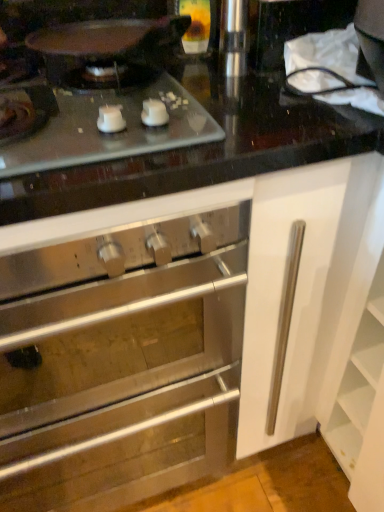
Question: From the image's perspective, does stainless steel oven at center appear higher than matte glass cooktop at upper left?

Choices:
 (A) yes
 (B) no

Answer: (B)

Question: Is stainless steel oven at center thinner than matte glass cooktop at upper left?

Choices:
 (A) no
 (B) yes

Answer: (A)

Question: Are stainless steel oven at center and matte glass cooktop at upper left making contact?

Choices:
 (A) yes
 (B) no

Answer: (B)

Question: Considering the relative sizes of stainless steel oven at center and matte glass cooktop at upper left in the image provided, is stainless steel oven at center bigger than matte glass cooktop at upper left?

Choices:
 (A) yes
 (B) no

Answer: (A)

Question: Could you tell me if stainless steel oven at center is facing matte glass cooktop at upper left?

Choices:
 (A) yes
 (B) no

Answer: (B)

Question: Considering the relative positions of stainless steel oven at center and matte glass cooktop at upper left in the image provided, is stainless steel oven at center to the left of matte glass cooktop at upper left from the viewer's perspective?

Choices:
 (A) yes
 (B) no

Answer: (A)

Question: Considering the relative sizes of matte glass cooktop at upper left and stainless steel oven at center in the image provided, is matte glass cooktop at upper left bigger than stainless steel oven at center?

Choices:
 (A) yes
 (B) no

Answer: (B)

Question: Is matte glass cooktop at upper left to the left of stainless steel oven at center from the viewer's perspective?

Choices:
 (A) no
 (B) yes

Answer: (A)

Question: From the image's perspective, is matte glass cooktop at upper left over stainless steel oven at center?

Choices:
 (A) yes
 (B) no

Answer: (A)

Question: Is the position of matte glass cooktop at upper left more distant than that of stainless steel oven at center?

Choices:
 (A) no
 (B) yes

Answer: (B)

Question: Does matte glass cooktop at upper left have a greater width compared to stainless steel oven at center?

Choices:
 (A) no
 (B) yes

Answer: (A)

Question: Is matte glass cooktop at upper left smaller than stainless steel oven at center?

Choices:
 (A) yes
 (B) no

Answer: (A)

Question: Is stainless steel oven at center in front of or behind matte glass cooktop at upper left in the image?

Choices:
 (A) front
 (B) behind

Answer: (A)